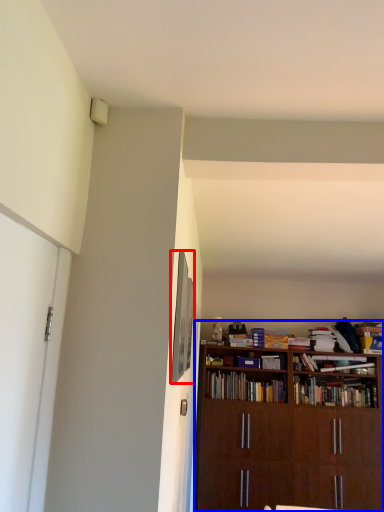
Question: Which object is closer to the camera taking this photo, picture frame (highlighted by a red box) or bookcase (highlighted by a blue box)?

Choices:
 (A) picture frame
 (B) bookcase

Answer: (A)